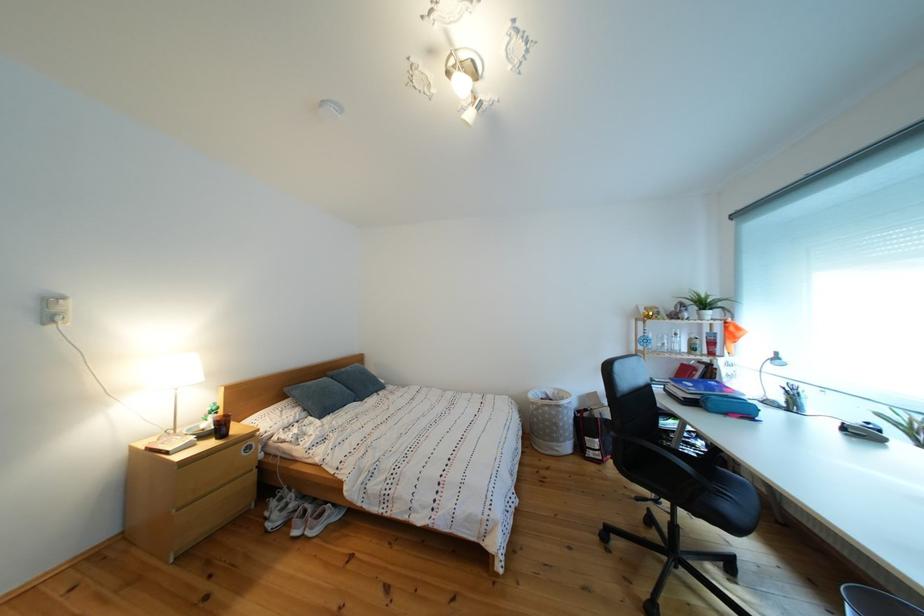
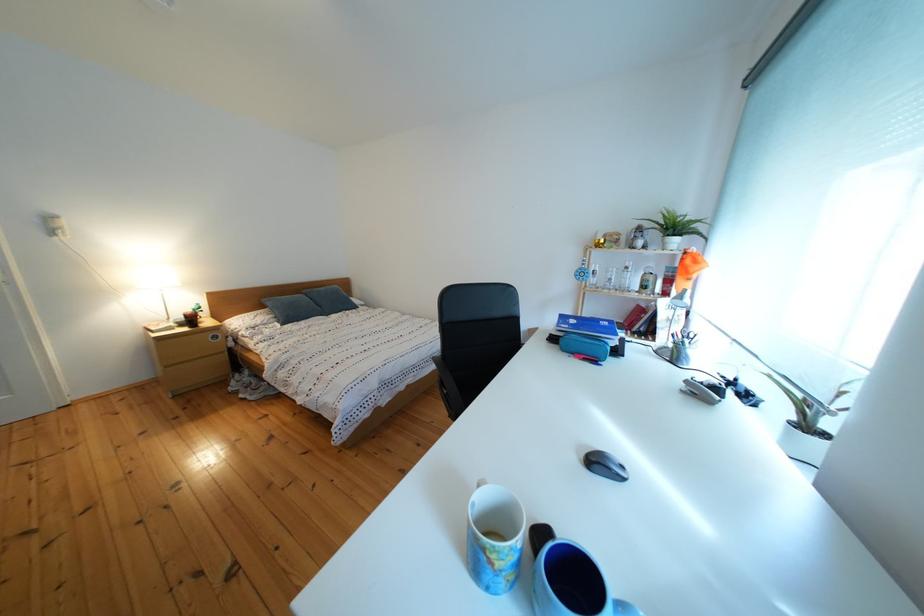
Question: What movement of the cameraman would produce the second image?

Choices:
 (A) Left
 (B) Right
 (C) Forward
 (D) Backward

Answer: (B)